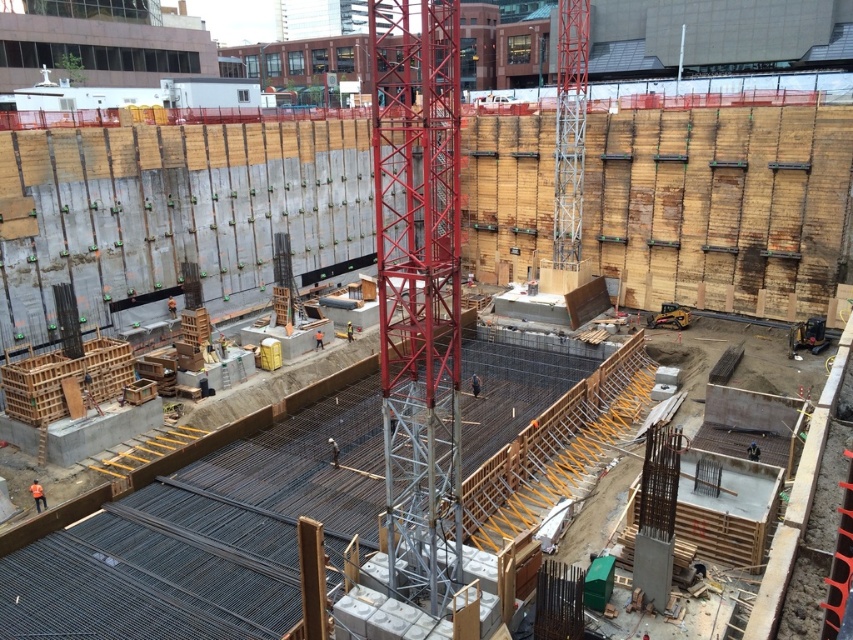
You are a construction worker standing at the edge of the construction site. You notice the concrete rebar at center and the metallic red tower crane at center. Which object is closer to you?

The concrete rebar at center is closer to you because the metallic red tower crane at center is behind it.

You are a construction worker standing at the entrance of the site. You need to locate the concrete rebar at center. According to the coordinates provided, where should you look to find it?

The concrete rebar at center is located at point (199, 529), so you should look towards the central area of the site where the coordinates indicate its position.

You are an engineer inspecting the construction site. You need to determine if the concrete rebar at center can be safely moved using the metallic red tower crane at center. What should you consider regarding their widths?

The concrete rebar at center is wider than the metallic red tower crane at center, so moving it may require careful planning to ensure it fits within the crane operation area.